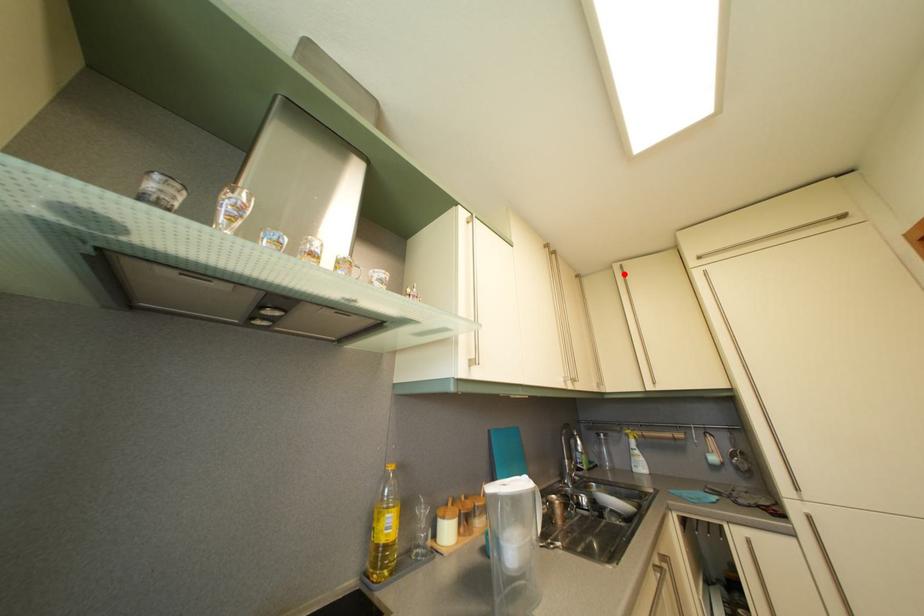
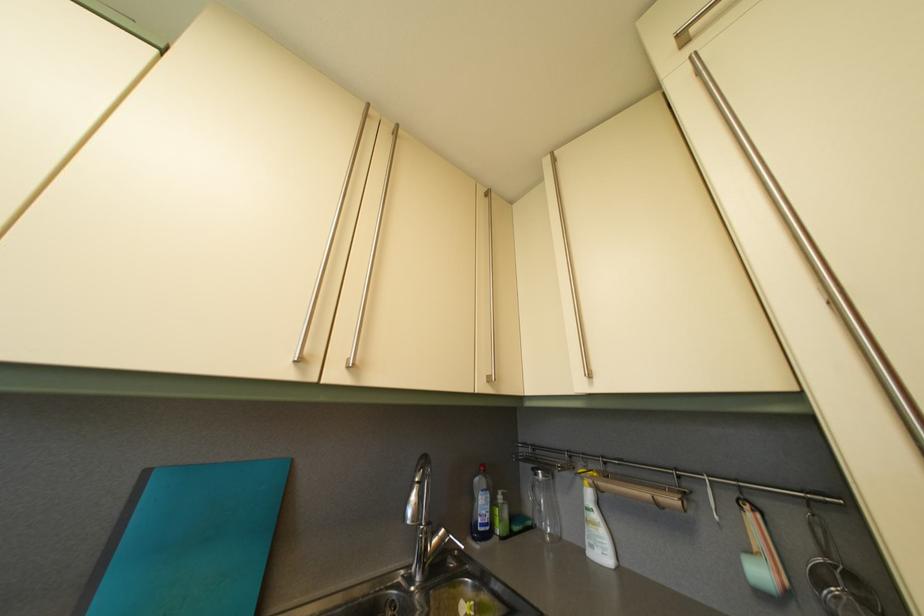
Where in the second image is the point corresponding to the highlighted location from the first image?

(554, 169)